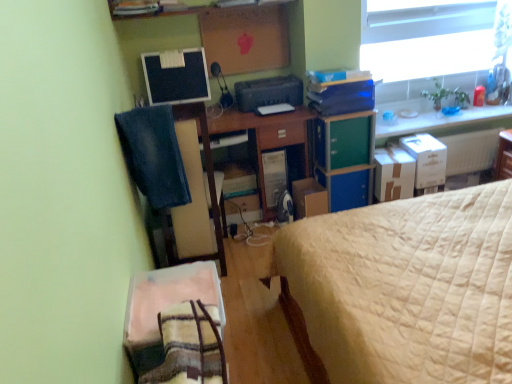
Question: Considering the relative sizes of beige quilted bed at right and cardboard box at center, the 3th cardboard box viewed from the right, in the image provided, is beige quilted bed at right thinner than cardboard box at center, the 3th cardboard box viewed from the right,?

Choices:
 (A) yes
 (B) no

Answer: (B)

Question: Is beige quilted bed at right further to camera compared to cardboard box at center, the 3th cardboard box viewed from the right?

Choices:
 (A) yes
 (B) no

Answer: (B)

Question: Considering the relative sizes of beige quilted bed at right and cardboard box at center, the 3th cardboard box viewed from the right, in the image provided, is beige quilted bed at right smaller than cardboard box at center, the 3th cardboard box viewed from the right,?

Choices:
 (A) no
 (B) yes

Answer: (A)

Question: Would you say cardboard box at center, the 3th cardboard box viewed from the right, is part of beige quilted bed at right's contents?

Choices:
 (A) yes
 (B) no

Answer: (B)

Question: Is beige quilted bed at right at the right side of cardboard box at center, the 3th cardboard box viewed from the right?

Choices:
 (A) yes
 (B) no

Answer: (A)

Question: Considering the relative sizes of beige quilted bed at right and cardboard box at center, positioned as the 1th cardboard box in left-to-right order, in the image provided, is beige quilted bed at right shorter than cardboard box at center, positioned as the 1th cardboard box in left-to-right order,?

Choices:
 (A) yes
 (B) no

Answer: (B)

Question: Considering the relative positions of brown cardboard box at right, the second cardboard box viewed from the left, and cardboard box at center, positioned as the 1th cardboard box in left-to-right order, in the image provided, is brown cardboard box at right, the second cardboard box viewed from the left, to the left of cardboard box at center, positioned as the 1th cardboard box in left-to-right order, from the viewer's perspective?

Choices:
 (A) yes
 (B) no

Answer: (B)

Question: From the image's perspective, is brown cardboard box at right, which is counted as the 2th cardboard box, starting from the right, on top of cardboard box at center, the 3th cardboard box viewed from the right?

Choices:
 (A) yes
 (B) no

Answer: (A)

Question: From a real-world perspective, is brown cardboard box at right, which is counted as the 2th cardboard box, starting from the right, on cardboard box at center, positioned as the 1th cardboard box in left-to-right order?

Choices:
 (A) yes
 (B) no

Answer: (A)

Question: Does brown cardboard box at right, the second cardboard box viewed from the left, have a greater height compared to cardboard box at center, positioned as the 1th cardboard box in left-to-right order?

Choices:
 (A) yes
 (B) no

Answer: (B)

Question: Does brown cardboard box at right, the second cardboard box viewed from the left, turn towards cardboard box at center, positioned as the 1th cardboard box in left-to-right order?

Choices:
 (A) yes
 (B) no

Answer: (B)

Question: Considering the relative positions of brown cardboard box at right, which is counted as the 2th cardboard box, starting from the right, and cardboard box at center, the 3th cardboard box viewed from the right, in the image provided, is brown cardboard box at right, which is counted as the 2th cardboard box, starting from the right, in front of cardboard box at center, the 3th cardboard box viewed from the right,?

Choices:
 (A) yes
 (B) no

Answer: (A)

Question: Is satin black computer tower at center turned away from cardboard box at center, positioned as the 1th cardboard box in left-to-right order?

Choices:
 (A) no
 (B) yes

Answer: (A)